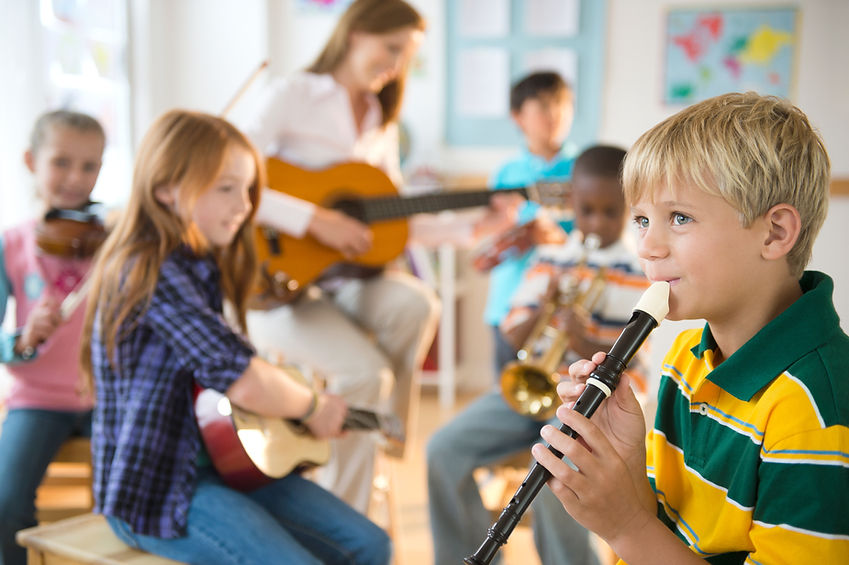
Locate an element on the screen. brown border for painting is located at coordinates (799, 55), (665, 62).